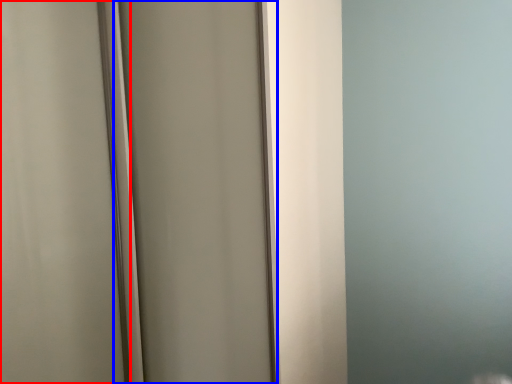
Question: Among these objects, which one is nearest to the camera, screen door (highlighted by a red box) or screen door (highlighted by a blue box)?

Choices:
 (A) screen door
 (B) screen door

Answer: (A)